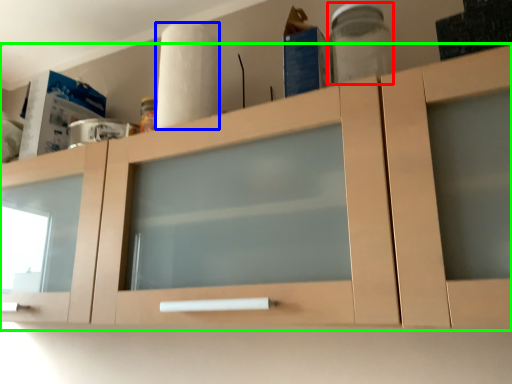
Question: Considering the real-world distances, which object is farthest from glass jar (highlighted by a red box)? paper towel (highlighted by a blue box) or cabinetry (highlighted by a green box)?

Choices:
 (A) paper towel
 (B) cabinetry

Answer: (B)